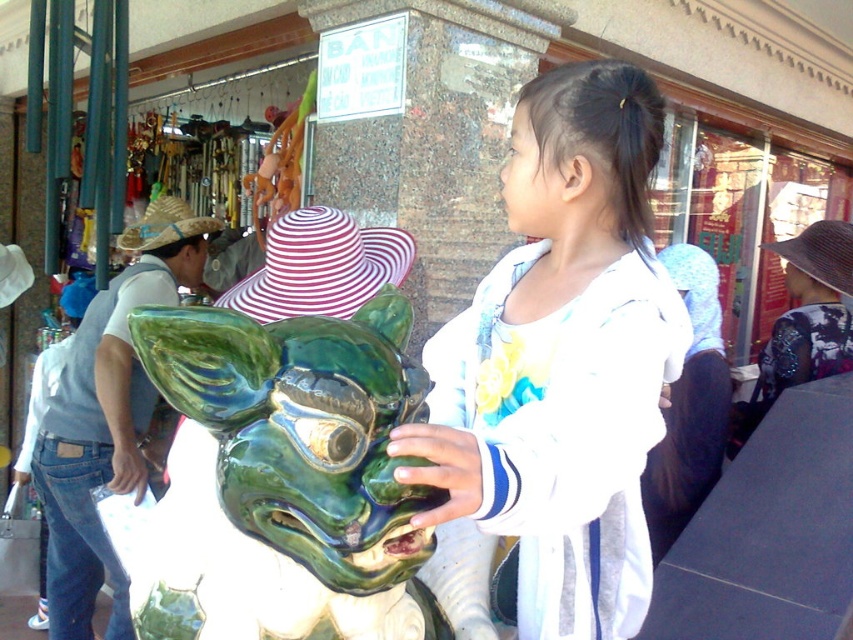
Question: Is white matte shirt at center positioned at the back of green glazed sculpture at center?

Choices:
 (A) no
 (B) yes

Answer: (A)

Question: Is white matte shirt at center bigger than green glazed sculpture at center?

Choices:
 (A) no
 (B) yes

Answer: (B)

Question: Is white matte shirt at center closer to the viewer compared to green glazed sculpture at center?

Choices:
 (A) no
 (B) yes

Answer: (B)

Question: Which point is farther to the camera?

Choices:
 (A) green glazed sculpture at center
 (B) white matte shirt at center

Answer: (A)